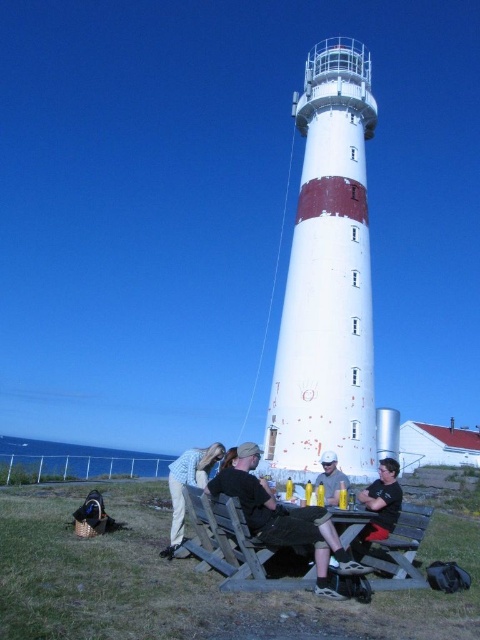
Between black fabric shirt at lower right and matte black shirt at lower center, which one has less height?

matte black shirt at lower center

Does black fabric shirt at lower right appear over matte black shirt at lower center?

Actually, black fabric shirt at lower right is below matte black shirt at lower center.

Is point (392, 504) positioned behind point (324, 497)?

No.

Where is `black fabric shirt at lower right`? This screenshot has width=480, height=640. black fabric shirt at lower right is located at coordinates click(x=380, y=506).

Where is `wooden picnic table at lower center`? wooden picnic table at lower center is located at coordinates (x=312, y=536).

Is wooden picnic table at lower center positioned in front of black fabric shirt at lower right?

That is True.

I want to click on wooden picnic table at lower center, so click(312, 536).

Between point (219, 486) and point (389, 552), which one is positioned in front?

Point (219, 486)

Who is shorter, black cotton shirt at lower center or wooden park bench at lower right?

With less height is wooden park bench at lower right.

Is point (322, 561) positioned behind point (393, 552)?

No.

Image resolution: width=480 pixels, height=640 pixels. I want to click on black cotton shirt at lower center, so click(284, 518).